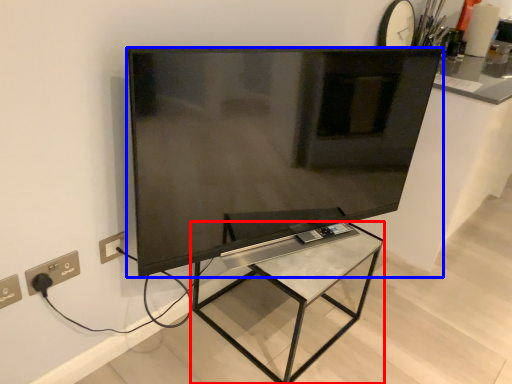
Question: Which of the following is the farthest to the observer, furniture (highlighted by a red box) or television (highlighted by a blue box)?

Choices:
 (A) furniture
 (B) television

Answer: (A)